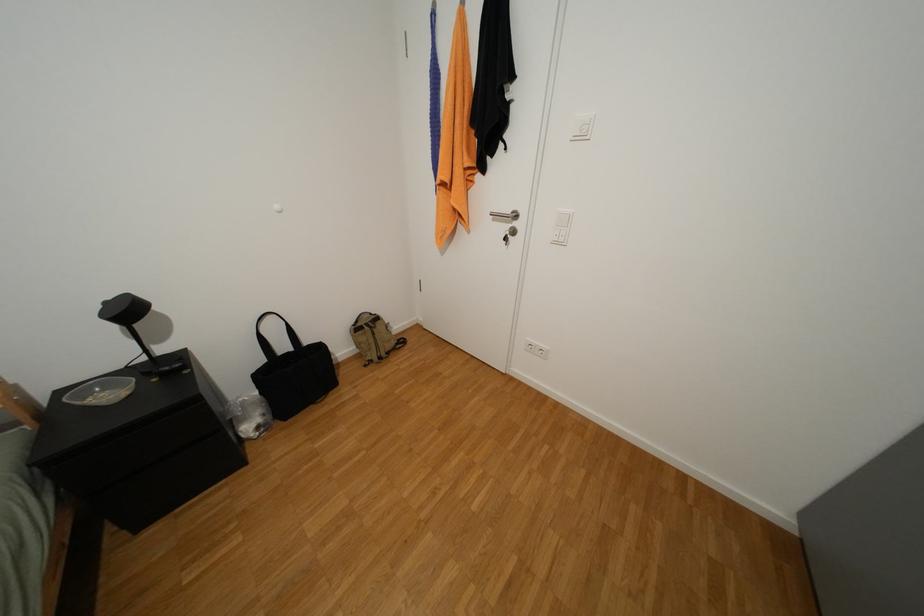
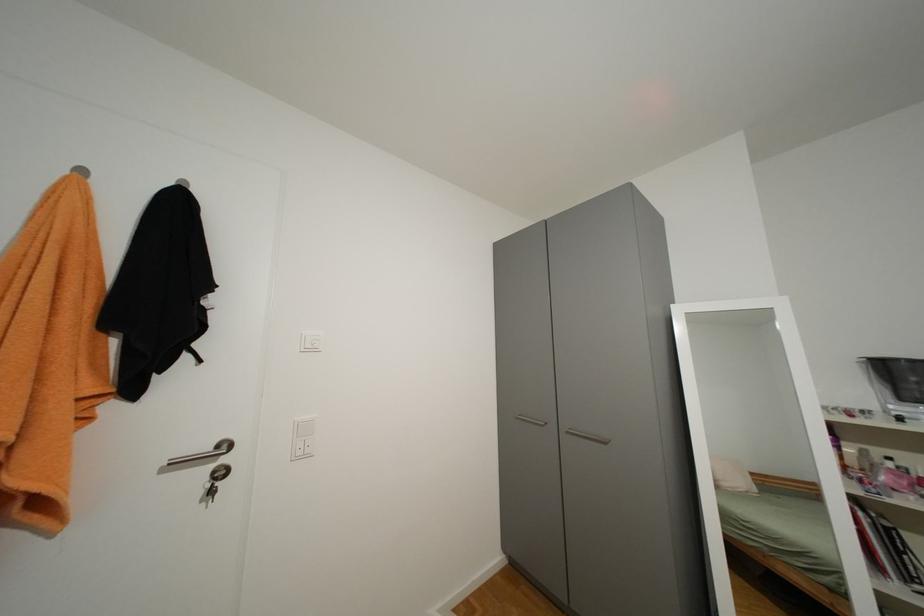
Question: Based on the continuous images, in which direction is the camera rotating? Reply with the corresponding letter.

Choices:
 (A) Left
 (B) Right
 (C) Up
 (D) Down

Answer: (B)